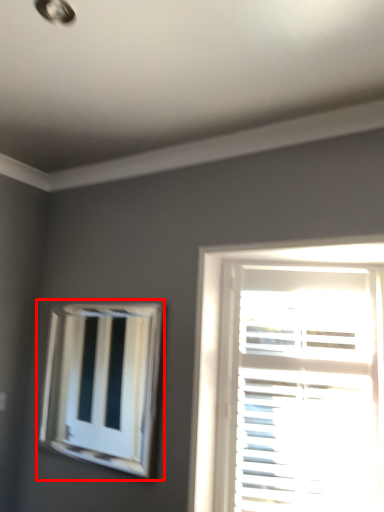
Question: From the image's perspective, where is bay window (annotated by the red box) located relative to window?

Choices:
 (A) above
 (B) below

Answer: (A)